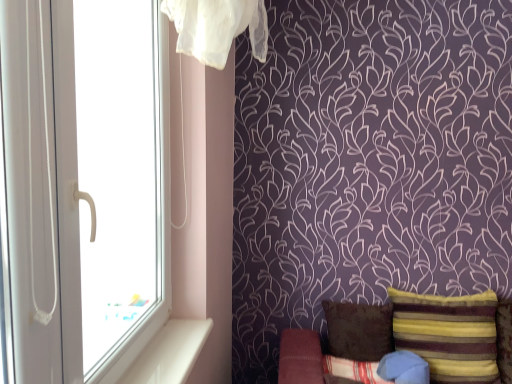
Question: Considering the positions of striped velvet pillow at lower right, marked as the 4th pillow in a left-to-right arrangement, and brown fabric pillow at lower right, which ranks as the 4th pillow in right-to-left order, in the image, is striped velvet pillow at lower right, marked as the 4th pillow in a left-to-right arrangement, bigger or smaller than brown fabric pillow at lower right, which ranks as the 4th pillow in right-to-left order,?

Choices:
 (A) big
 (B) small

Answer: (A)

Question: Choose the correct answer: Is striped velvet pillow at lower right, positioned as the 1th pillow in right-to-left order, inside brown fabric pillow at lower right, which ranks as the 4th pillow in right-to-left order, or outside it?

Choices:
 (A) inside
 (B) outside

Answer: (B)

Question: Which is nearer to the white smooth window sill at lower left?

Choices:
 (A) striped velvet pillow at lower right, marked as the 4th pillow in a left-to-right arrangement
 (B) blue fabric pillow at lower right, acting as the 2th pillow starting from the right
 (C) blue cotton pillow at lower right, which is the second pillow in left-to-right order
 (D) brown fabric pillow at lower right, which ranks as the 4th pillow in right-to-left order
 (E) white plastic window at left

Answer: (E)

Question: Considering the real-world distances, which object is closest to the blue cotton pillow at lower right, which is the second pillow in left-to-right order?

Choices:
 (A) white plastic window at left
 (B) blue fabric pillow at lower right, the 3th pillow in the left-to-right sequence
 (C) striped velvet pillow at lower right, marked as the 4th pillow in a left-to-right arrangement
 (D) brown fabric pillow at lower right, which ranks as the 4th pillow in right-to-left order
 (E) white smooth window sill at lower left

Answer: (B)